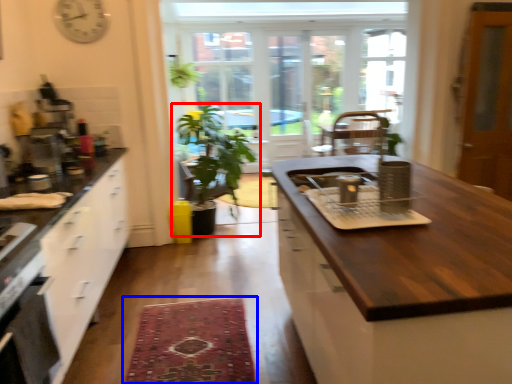
Question: Which object appears farthest to the camera in this image, houseplant (highlighted by a red box) or mat (highlighted by a blue box)?

Choices:
 (A) houseplant
 (B) mat

Answer: (A)